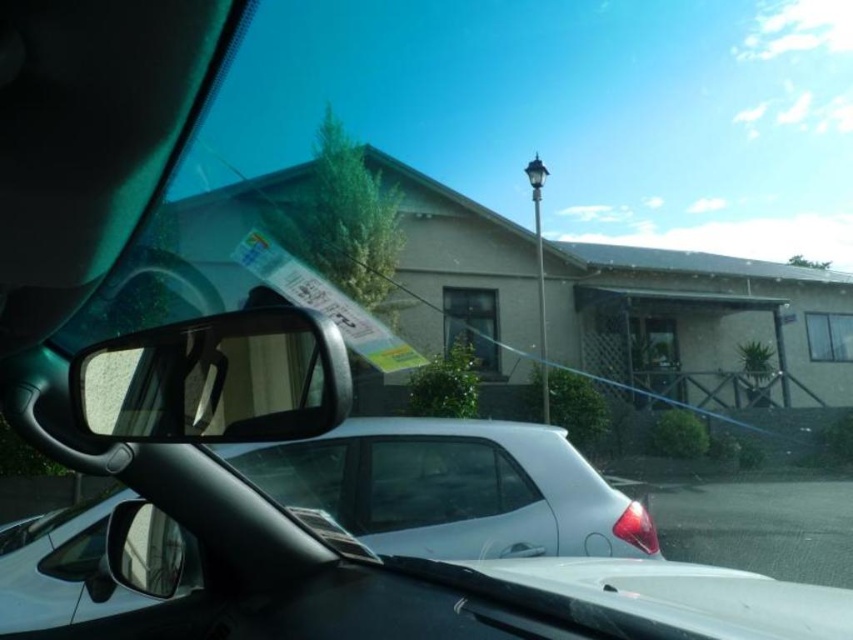
Is white glossy car at center wider than transparent plastic view mirror at left?

Yes.

Is white glossy car at center closer to camera compared to transparent plastic view mirror at left?

No, white glossy car at center is behind transparent plastic view mirror at left.

Locate an element on the screen. The image size is (853, 640). white glossy car at center is located at coordinates (453, 488).

Which is more to the left, transparent plastic view mirror at left or transparent glass car window at center?

transparent plastic view mirror at left is more to the left.

Can you confirm if transparent plastic view mirror at left is wider than transparent glass car window at center?

No, transparent plastic view mirror at left is not wider than transparent glass car window at center.

Measure the distance between point (231, 387) and camera.

Point (231, 387) and camera are 7.28 feet apart.

Where is `transparent plastic view mirror at left`? The width and height of the screenshot is (853, 640). transparent plastic view mirror at left is located at coordinates (216, 380).

From the picture: Is white glossy car at center wider than transparent glass car window at center?

Yes, white glossy car at center is wider than transparent glass car window at center.

Is point (277, 490) farther from viewer compared to point (445, 456)?

No, (277, 490) is closer to viewer.

In order to click on white glossy car at center in this screenshot , I will do `click(453, 488)`.